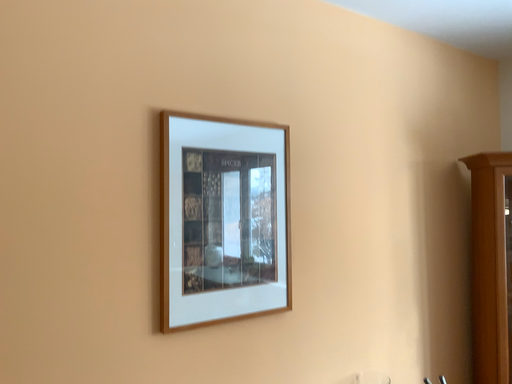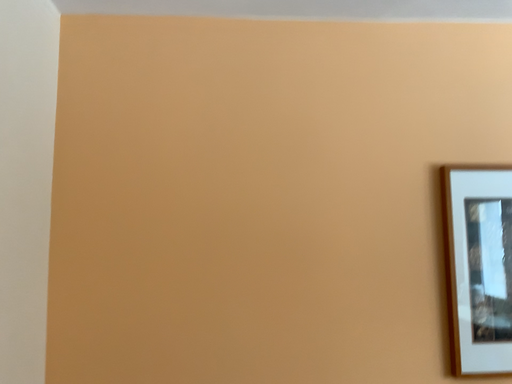
Question: How did the camera likely rotate when shooting the video?

Choices:
 (A) rotated right
 (B) rotated left

Answer: (B)